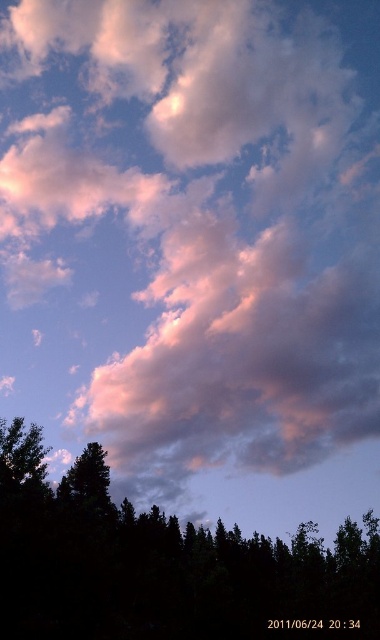
You are a photographer aiming to capture the entire sky scene. You notice two points in the image labeled as point (42, 545) and point (101, 465). Which point should you focus on to ensure the closest object in the scene is sharp?

Point (42, 545) is closer to the camera than point (101, 465), so focusing on point (42, 545) will ensure the closest object in the scene is sharp.

You are a bird flying over the forest and want to land on a tree. Which tree would be closer to you if you choose between the dark green leafy tree at bottom and the dark green textured tree at lower left?

The dark green leafy tree at bottom is closer to you because it is in front of the dark green textured tree at lower left.

You are an ornithologist observing birds in the forest. You notice two trees in the scene. Which tree is closer to the ground, the dark green leafy tree at bottom or the dark green textured tree at lower left?

The dark green leafy tree at bottom is positioned under the dark green textured tree at lower left, so it is closer to the ground.